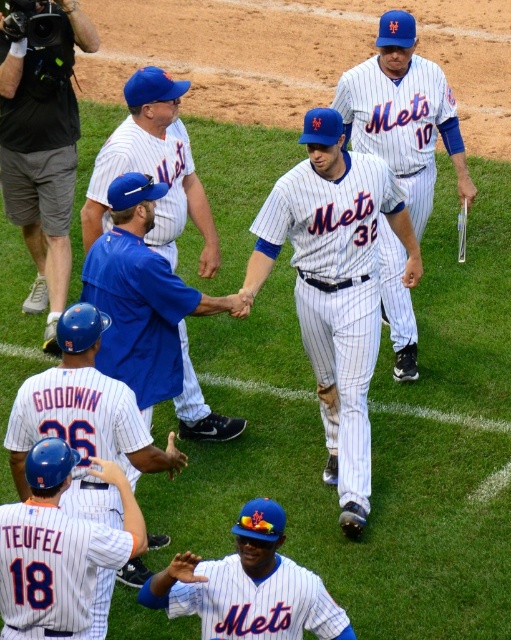
You are a photographer at the baseball game. You need to capture a closeup shot of the white pinstriped jersey at center and the white pinstriped uniform at center. Which one should you focus on if you want to avoid blurriness due to their size in the frame?

The white pinstriped jersey at center is thinner than the white pinstriped uniform at center, so focusing on the white pinstriped uniform at center would be better to avoid blurriness since it is wider and easier to capture clearly.

You are a photographer standing at the origin point of the coordinate system in the image. You want to take a photo of the point at point (350, 362) and point (91, 344). Which point should you focus on first if you are moving forward along the positive y axis direction?

Since point (350, 362) is behind point (91, 344), you should focus on point (91, 344) first before moving forward to capture point (350, 362).

You are a photographer at the baseball stadium and need to capture a photo of both the white pinstriped jersey at center and the blue jersey at center. Since you want both to be clearly visible, which jersey should you focus on first to ensure it appears in focus, considering their sizes?

The white pinstriped jersey at center is bigger than the blue jersey at center, so you should focus on the white pinstriped jersey at center first to ensure it appears in focus, as larger objects typically require more precise focusing to maintain clarity.